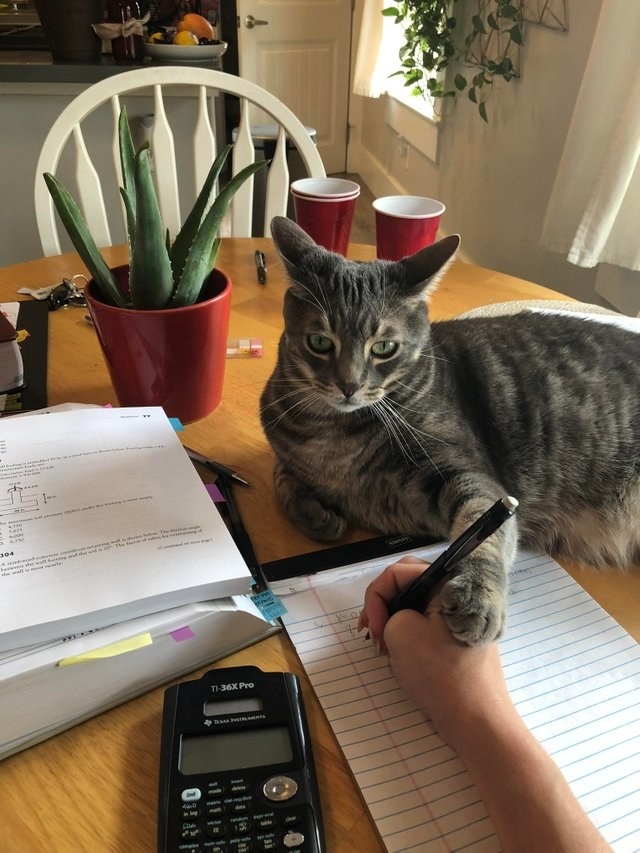
Where is `cups`? cups is located at coordinates (326, 207), (422, 223).